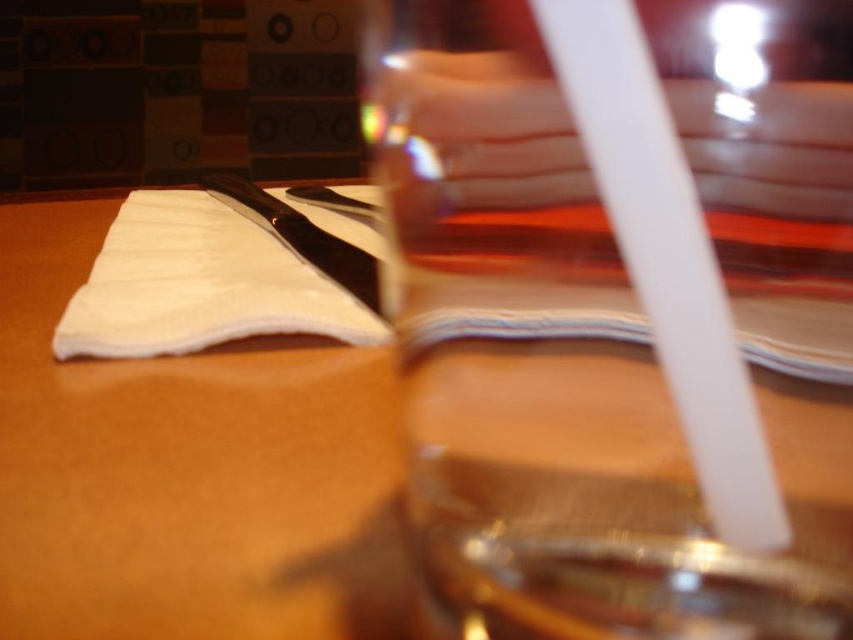
Question: Does wooden table at center appear under polished metal knife at center?

Choices:
 (A) yes
 (B) no

Answer: (A)

Question: Does transparent glass at center have a larger size compared to wooden table at center?

Choices:
 (A) no
 (B) yes

Answer: (A)

Question: Does transparent glass at center have a greater width compared to wooden table at center?

Choices:
 (A) no
 (B) yes

Answer: (A)

Question: Which point appears farthest from the camera in this image?

Choices:
 (A) (228, 307)
 (B) (822, 241)

Answer: (A)

Question: Which object is positioned farthest from the transparent glass at center?

Choices:
 (A) polished metal knife at center
 (B) wooden table at center
 (C) white fabric at center

Answer: (A)

Question: Which of the following is the closest to the observer?

Choices:
 (A) white fabric at center
 (B) wooden table at center
 (C) transparent glass at center

Answer: (C)